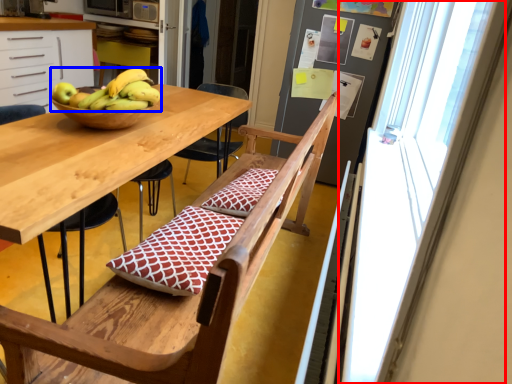
Question: Which object is further to the camera taking this photo, window screen (highlighted by a red box) or banana (highlighted by a blue box)?

Choices:
 (A) window screen
 (B) banana

Answer: (B)